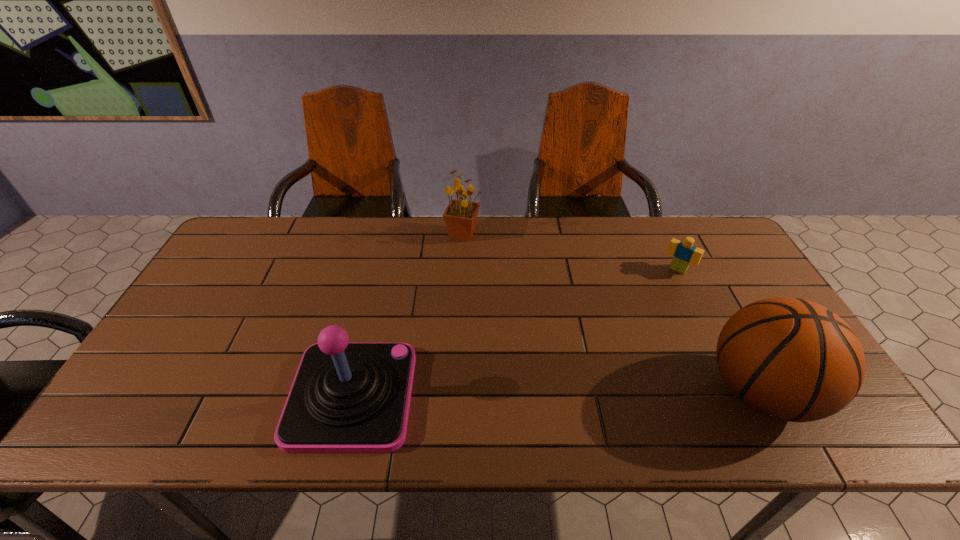
You are a GUI agent. You are given a task and a screenshot of the screen. Output one action in this format:
    pyautogui.click(x=<x>, y=<y>)
    Task: Click on the vacant space located 0.300m at the front of the sunflower with flowers visible
    The height and width of the screenshot is (540, 960).
    Given the screenshot: What is the action you would take?
    pyautogui.click(x=524, y=301)

Locate an element on the screen. free region located on the face of the shortest object is located at coordinates (612, 361).

At what (x,y) coordinates should I click in order to perform the action: click on vacant space located on the face of the shortest object. Please return your answer as a coordinate pair (x, y). Looking at the image, I should click on tap(638, 323).

Find the location of a particular element. The image size is (960, 540). blank space located on the face of the shortest object is located at coordinates (657, 298).

This screenshot has width=960, height=540. What are the coordinates of `sunflower at the far edge` in the screenshot? It's located at (460, 217).

Identify the location of Lego present at the far edge. The height and width of the screenshot is (540, 960). (684, 253).

This screenshot has width=960, height=540. What are the coordinates of `joystick that is at the near edge` in the screenshot? It's located at (346, 397).

Identify the location of basketball that is at the near edge. (790, 359).

The image size is (960, 540). Identify the location of object at the right edge. (790, 359).

The width and height of the screenshot is (960, 540). I want to click on object located at the near right corner, so click(790, 359).